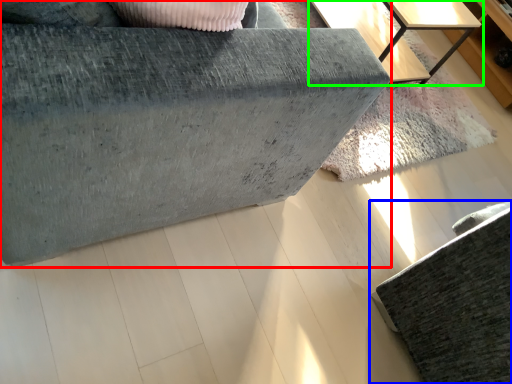
Question: Which is farther away from furniture (highlighted by a red box)? furniture (highlighted by a blue box) or table (highlighted by a green box)?

Choices:
 (A) furniture
 (B) table

Answer: (B)